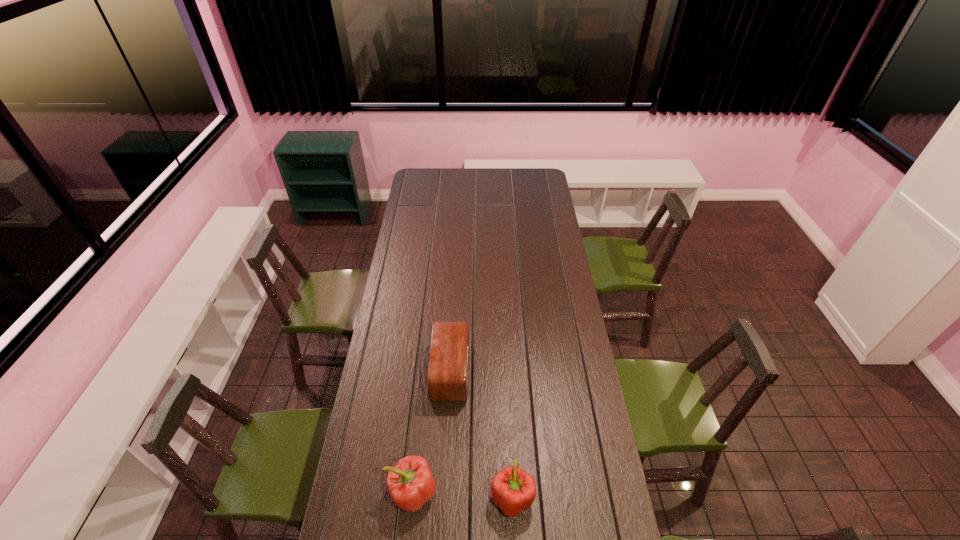
The width and height of the screenshot is (960, 540). Identify the location of the farthest object. (447, 380).

Identify the location of the left bell pepper. The height and width of the screenshot is (540, 960). (410, 482).

Locate an element on the screen. This screenshot has height=540, width=960. the right bell pepper is located at coordinates (513, 490).

Identify the location of free space located on the front panel of the radio receiver. This screenshot has width=960, height=540. (497, 372).

Find the location of `vacant space located on the front of the left bell pepper`. vacant space located on the front of the left bell pepper is located at coordinates (408, 535).

Where is `free space located 0.070m on the left of the rightmost object`? free space located 0.070m on the left of the rightmost object is located at coordinates (469, 497).

Find the location of a particular element. The height and width of the screenshot is (540, 960). object located at the left edge is located at coordinates (410, 482).

The image size is (960, 540). Identify the location of vacant point at the far edge. (459, 168).

Where is `free space at the left edge`? This screenshot has width=960, height=540. free space at the left edge is located at coordinates (388, 526).

Identify the location of vacant area at the right edge. (537, 212).